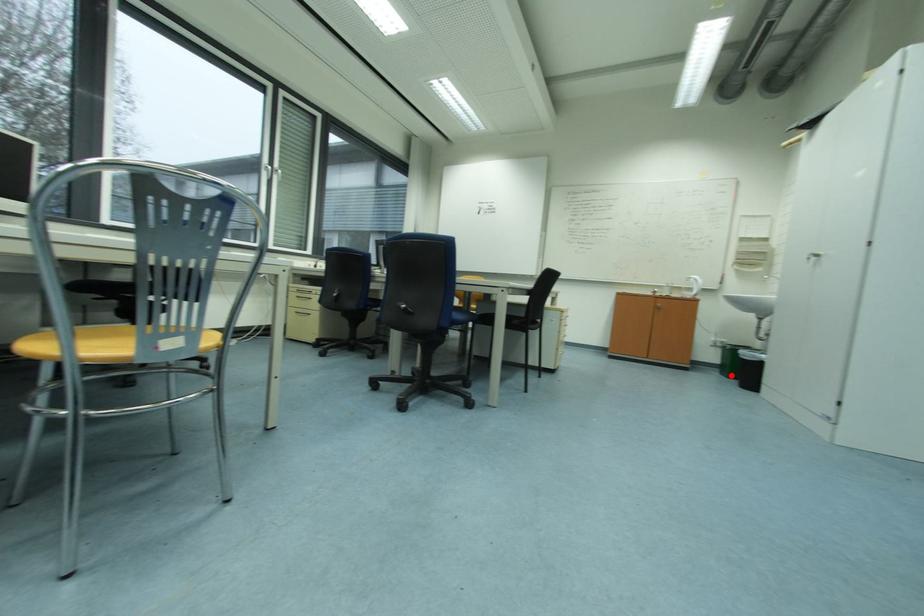
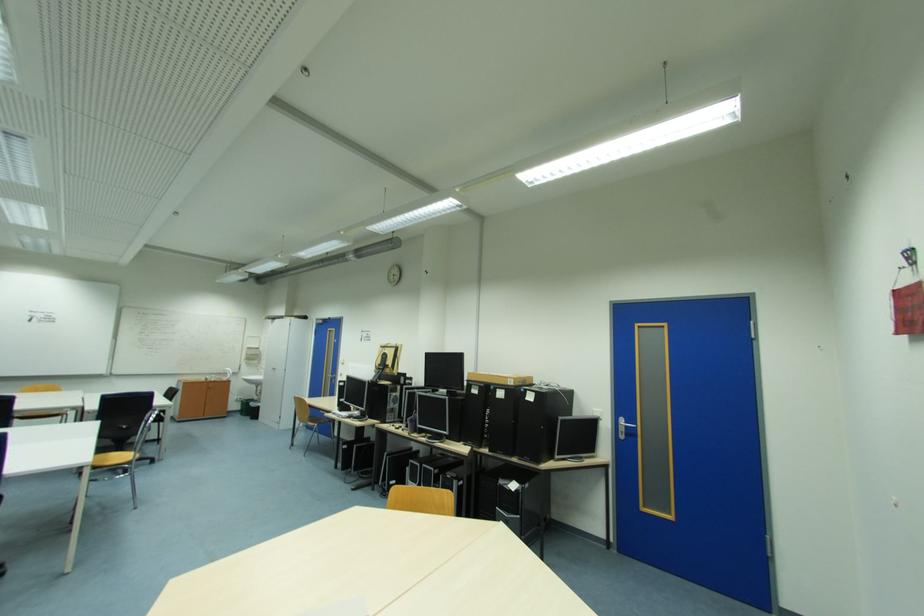
Question: I am providing you with two images of the same scene from different viewpoints. A red point is shown in image1. For the corresponding object point in image2, is it positioned nearer or farther from the camera?

Choices:
 (A) Nearer
 (B) Farther

Answer: (B)